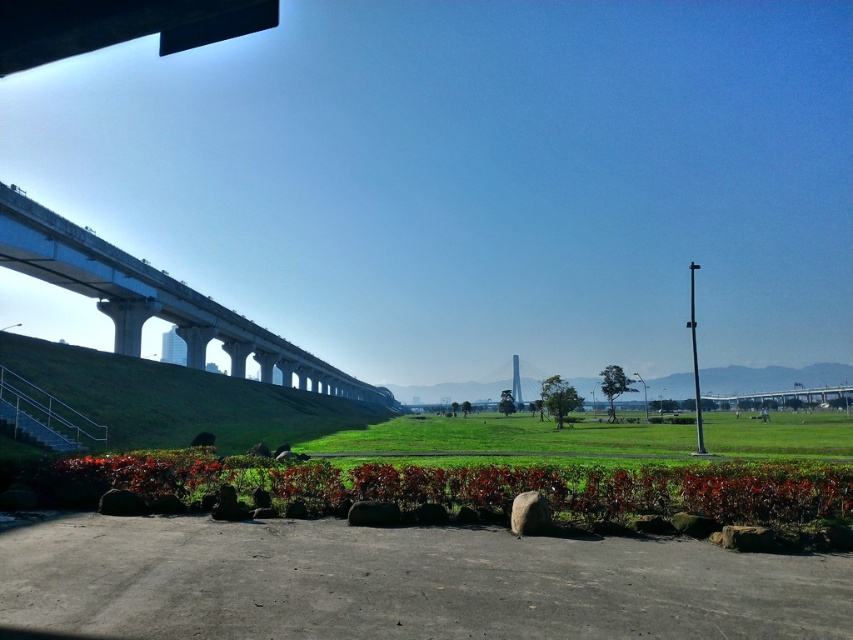
Question: Is concrete bridge at left bigger than white concrete pillar at center?

Choices:
 (A) yes
 (B) no

Answer: (A)

Question: Does concrete bridge at left have a smaller size compared to white concrete pillar at center?

Choices:
 (A) no
 (B) yes

Answer: (A)

Question: Estimate the real-world distances between objects in this image. Which object is closer to the concrete bridge at left?

Choices:
 (A) glossy red flower at lower center
 (B) green grassy hill at left
 (C) white concrete pillar at center

Answer: (B)

Question: Does green grassy hill at left appear over white concrete pillar at center?

Choices:
 (A) yes
 (B) no

Answer: (A)

Question: Which point appears farthest from the camera in this image?

Choices:
 (A) tap(200, 310)
 (B) tap(512, 378)

Answer: (B)

Question: Which object is closer to the camera taking this photo?

Choices:
 (A) glossy red flower at lower center
 (B) concrete bridge at left
 (C) white concrete pillar at center

Answer: (A)